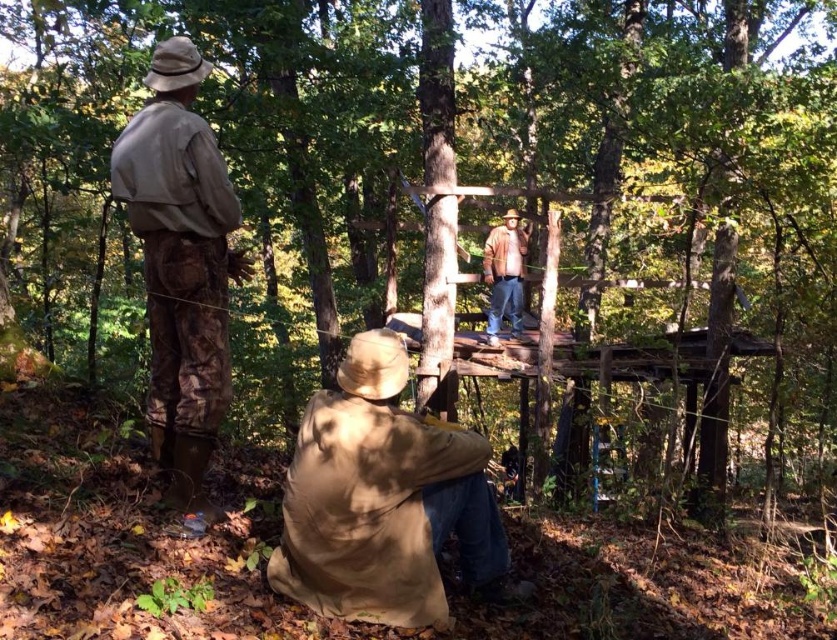
Question: Can you confirm if tan fabric jacket at lower center is bigger than brown leather jacket at upper center?

Choices:
 (A) yes
 (B) no

Answer: (B)

Question: Among these points, which one is nearest to the camera?

Choices:
 (A) (190, 449)
 (B) (478, 541)
 (C) (493, 268)

Answer: (B)

Question: Estimate the real-world distances between objects in this image. Which object is closer to the camouflage pants at left?

Choices:
 (A) brown leather jacket at upper center
 (B) tan fabric jacket at lower center

Answer: (B)

Question: From the image, what is the correct spatial relationship of tan fabric jacket at lower center in relation to camouflage pants at left?

Choices:
 (A) left
 (B) right

Answer: (B)

Question: Is tan fabric jacket at lower center bigger than brown leather jacket at upper center?

Choices:
 (A) yes
 (B) no

Answer: (B)

Question: Which of the following is the farthest from the observer?

Choices:
 (A) camouflage pants at left
 (B) tan fabric jacket at lower center
 (C) brown leather jacket at upper center

Answer: (C)